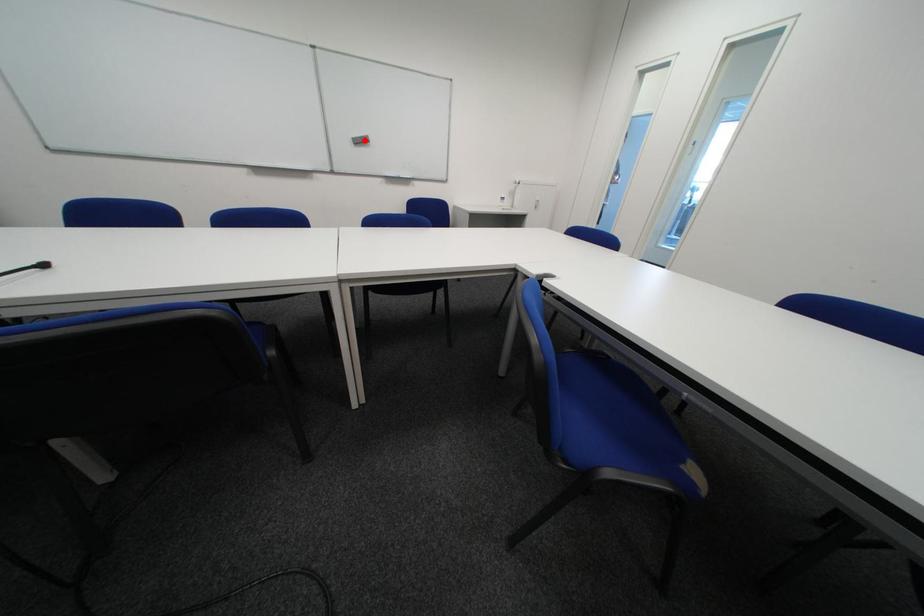
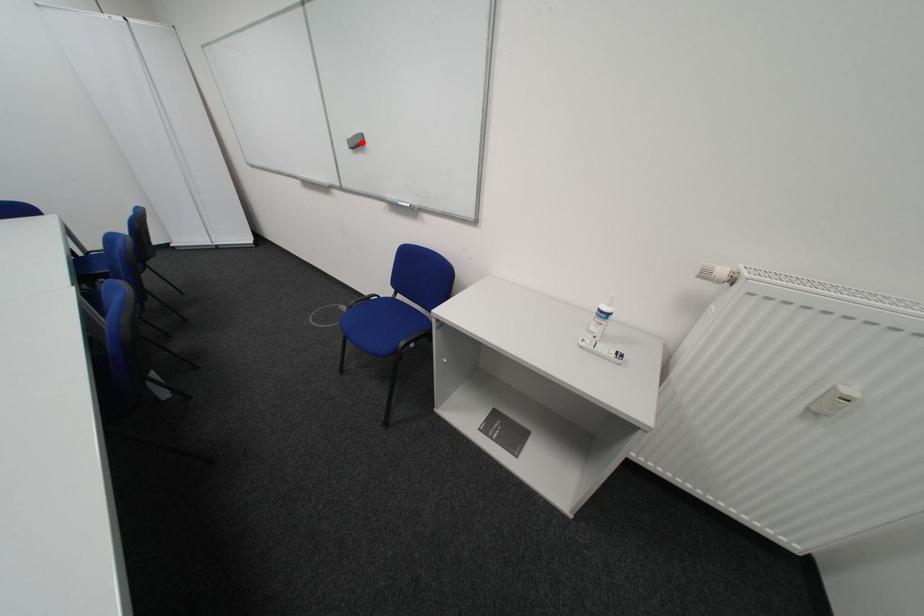
I am providing you with two images of the same scene from different viewpoints. A red point is marked on the first image and another point is marked on the second image. Are the points marked in image1 and image2 representing the same 3D position?

Yes